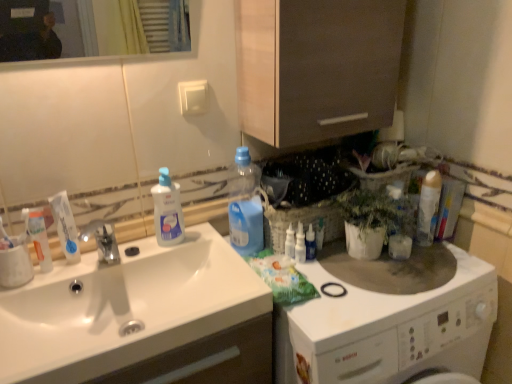
This screenshot has height=384, width=512. I want to click on spots to the right of white glossy toothpaste at left, so click(x=125, y=260).